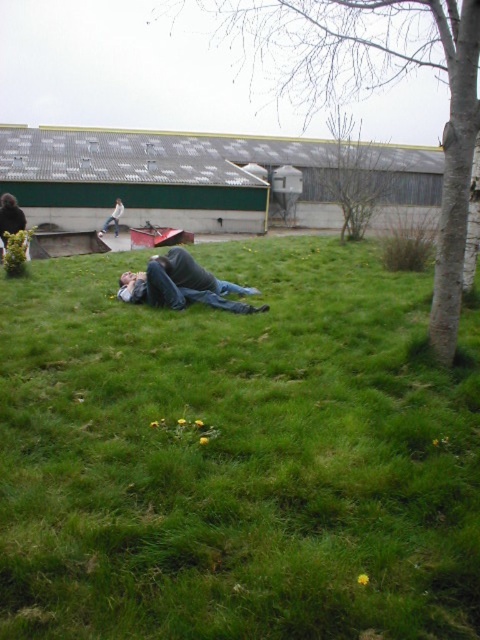
Question: Can you confirm if bare branches at upper center is thinner than denim jeans at center?

Choices:
 (A) no
 (B) yes

Answer: (A)

Question: Considering the real-world distances, which object is farthest from the denim jeans at center?

Choices:
 (A) bark textured tree at lower right
 (B) bare branches at upper center

Answer: (A)

Question: Does bark textured tree at lower right have a greater width compared to denim jeans at center?

Choices:
 (A) yes
 (B) no

Answer: (A)

Question: Is bark textured tree at lower right below denim jeans at center?

Choices:
 (A) no
 (B) yes

Answer: (A)

Question: Which point is closer to the camera taking this photo?

Choices:
 (A) (400, 364)
 (B) (347, 234)

Answer: (A)

Question: Which object is positioned closest to the bark textured tree at lower right?

Choices:
 (A) green grass at center
 (B) denim jeans at center
 (C) bare branches at upper center

Answer: (C)